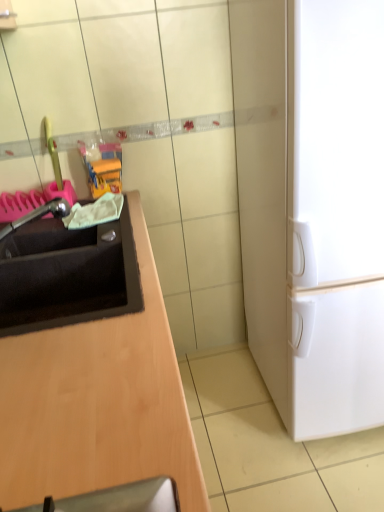
I want to click on satin nickel faucet at left, so (x=39, y=215).

Measure the distance between white matte refrigerator at right and camera.

36.14 inches.

What do you see at coordinates (67, 275) in the screenshot?
I see `black matte sink at left` at bounding box center [67, 275].

Where is `satin nickel faucet at left`? Image resolution: width=384 pixels, height=512 pixels. satin nickel faucet at left is located at coordinates (39, 215).

Is satin nickel faucet at left at the right side of white matte refrigerator at right?

Incorrect, satin nickel faucet at left is not on the right side of white matte refrigerator at right.

From the image's perspective, is satin nickel faucet at left under white matte refrigerator at right?

Yes, from the image's perspective, satin nickel faucet at left is beneath white matte refrigerator at right.

Identify the location of refrigerator below the satin nickel faucet at left (from a real-world perspective). This screenshot has width=384, height=512. (313, 206).

Considering the sizes of objects satin nickel faucet at left and white matte refrigerator at right in the image provided, who is thinner, satin nickel faucet at left or white matte refrigerator at right?

satin nickel faucet at left is thinner.

From the image's perspective, is black matte sink at left located above or below satin nickel faucet at left?

Based on their image positions, black matte sink at left is located beneath satin nickel faucet at left.

From a real-world perspective, who is located lower, black matte sink at left or satin nickel faucet at left?

black matte sink at left.

Is black matte sink at left far from satin nickel faucet at left?

No.

Is satin nickel faucet at left facing away from black matte sink at left?

No, satin nickel faucet at left's orientation is not away from black matte sink at left.

Is black matte sink at left located within satin nickel faucet at left?

No, black matte sink at left is not a part of satin nickel faucet at left.

Locate an element on the screen. This screenshot has height=512, width=384. sink that is on the right side of satin nickel faucet at left is located at coordinates tap(67, 275).

Is point (121, 234) in front of point (302, 298)?

No, it is behind (302, 298).

How many degrees apart are the facing directions of black matte sink at left and white matte refrigerator at right?

92.1 degrees separate the facing orientations of black matte sink at left and white matte refrigerator at right.

Is the depth of black matte sink at left less than that of white matte refrigerator at right?

No, it is behind white matte refrigerator at right.

In terms of width, does black matte sink at left look wider or thinner when compared to white matte refrigerator at right?

In the image, black matte sink at left appears to be more narrow than white matte refrigerator at right.

Is white matte refrigerator at right turned away from satin nickel faucet at left?

white matte refrigerator at right is not turned away from satin nickel faucet at left.

From a real-world perspective, who is located lower, white matte refrigerator at right or satin nickel faucet at left?

white matte refrigerator at right, from a real-world perspective.

Consider the image. In terms of height, does white matte refrigerator at right look taller or shorter compared to satin nickel faucet at left?

white matte refrigerator at right is taller than satin nickel faucet at left.

Considering the relative sizes of white matte refrigerator at right and black matte sink at left in the image provided, is white matte refrigerator at right bigger than black matte sink at left?

Yes.

Are white matte refrigerator at right and black matte sink at left located far from each other?

white matte refrigerator at right is actually quite close to black matte sink at left.

From the image's perspective, who appears lower, white matte refrigerator at right or black matte sink at left?

From the image's view, black matte sink at left is below.

From a real-world perspective, which object rests below the other?

From a 3D spatial view, white matte refrigerator at right is below.

In the image, there is a satin nickel faucet at left. Where is `refrigerator above it (from the image's perspective)`? refrigerator above it (from the image's perspective) is located at coordinates (313, 206).

Identify the location of sink on the right of the satin nickel faucet at left. (67, 275).

From the image, which object appears to be nearer to black matte sink at left, white matte refrigerator at right or satin nickel faucet at left?

Based on the image, satin nickel faucet at left appears to be nearer to black matte sink at left.

When comparing their distances from white matte refrigerator at right, does black matte sink at left or satin nickel faucet at left seem further?

satin nickel faucet at left lies further to white matte refrigerator at right than the other object.

Considering their positions, is satin nickel faucet at left positioned closer to white matte refrigerator at right than black matte sink at left?

black matte sink at left.

Based on their spatial positions, is satin nickel faucet at left or white matte refrigerator at right closer to black matte sink at left?

Based on the image, satin nickel faucet at left appears to be nearer to black matte sink at left.

When comparing their distances from satin nickel faucet at left, does white matte refrigerator at right or black matte sink at left seem further?

Among the two, white matte refrigerator at right is located further to satin nickel faucet at left.

Estimate the real-world distances between objects in this image. Which object is closer to satin nickel faucet at left, black matte sink at left or white matte refrigerator at right?

Based on the image, black matte sink at left appears to be nearer to satin nickel faucet at left.

Where is `sink between satin nickel faucet at left and white matte refrigerator at right in the horizontal direction`? The height and width of the screenshot is (512, 384). sink between satin nickel faucet at left and white matte refrigerator at right in the horizontal direction is located at coordinates (67, 275).